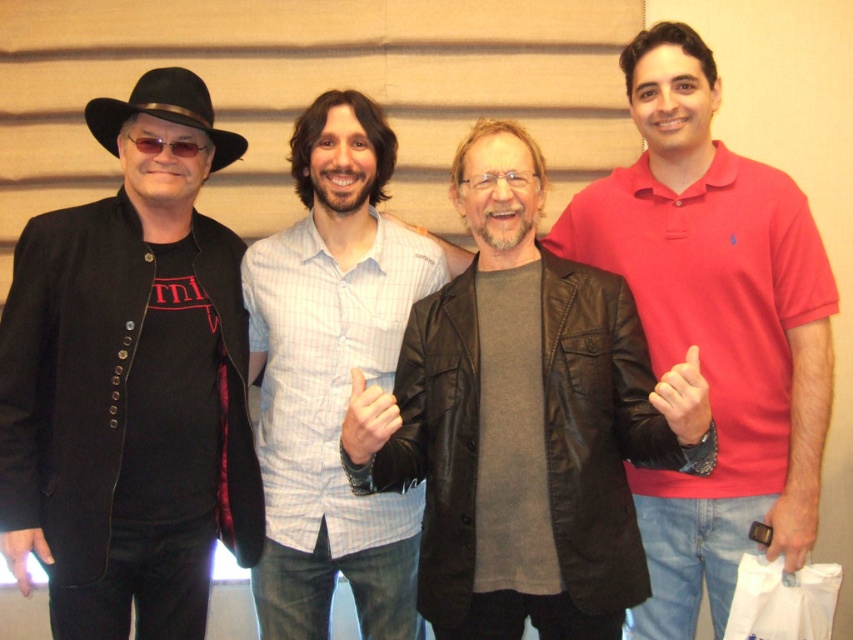
What is located at the coordinate point (524, 422) in the image?

The leather jacket at center is located at the coordinate point (524, 422).

Looking at the group photo, where is the leather jacket at center in relation to the black felt fedora at upper left?

The leather jacket at center is positioned under the black felt fedora at upper left.

Based on the scene description, which object is positioned higher in the image? The light blue striped shirt at center or the black felt fedora at upper left?

The black felt fedora at upper left is positioned higher in the image than the light blue striped shirt at center according to the description.